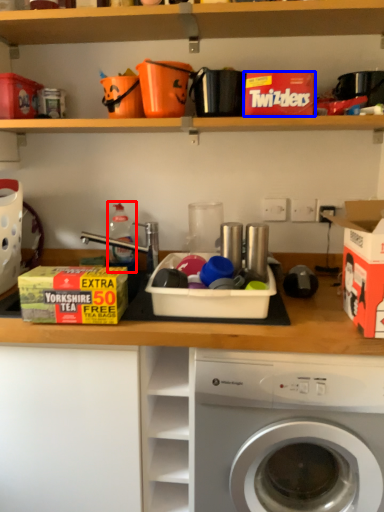
Question: Which object appears closest to the camera in this image, bottle (highlighted by a red box) or storage box (highlighted by a blue box)?

Choices:
 (A) bottle
 (B) storage box

Answer: (B)